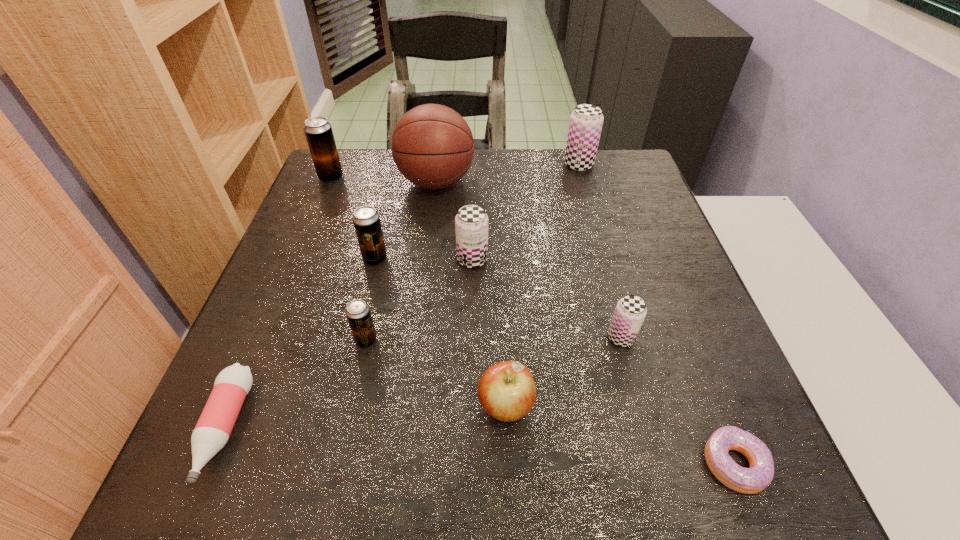
At what (x,y) coordinates should I click in order to perform the action: click on basketball. Please return your answer as a coordinate pair (x, y). Looking at the image, I should click on (432, 145).

Find the location of a particular element. The image size is (960, 540). the farthest purple beer can is located at coordinates (586, 121).

Where is `the biggest black beer can`? The width and height of the screenshot is (960, 540). the biggest black beer can is located at coordinates (318, 131).

At what (x,y) coordinates should I click in order to perform the action: click on the farthest black beer can. Please return your answer as a coordinate pair (x, y). Image resolution: width=960 pixels, height=540 pixels. Looking at the image, I should click on (318, 131).

You are a GUI agent. You are given a task and a screenshot of the screen. Output one action in this format:
    pyautogui.click(x=<x>, y=<y>)
    Task: Click on the second smallest purple beer can
    The width and height of the screenshot is (960, 540).
    Given the screenshot: What is the action you would take?
    pyautogui.click(x=471, y=223)

Find the location of a particular element. The height and width of the screenshot is (540, 960). the second nearest purple beer can is located at coordinates (471, 223).

You are a GUI agent. You are given a task and a screenshot of the screen. Output one action in this format:
    pyautogui.click(x=<x>, y=<y>)
    Task: Click on the second nearest black beer can
    This screenshot has height=540, width=960.
    Given the screenshot: What is the action you would take?
    pyautogui.click(x=366, y=220)

Find the location of `the nearest purple beer can`. the nearest purple beer can is located at coordinates (630, 312).

Locate an element on the screen. This screenshot has width=960, height=540. the nearest black beer can is located at coordinates (358, 313).

Locate an element on the screen. The height and width of the screenshot is (540, 960). apple is located at coordinates (506, 391).